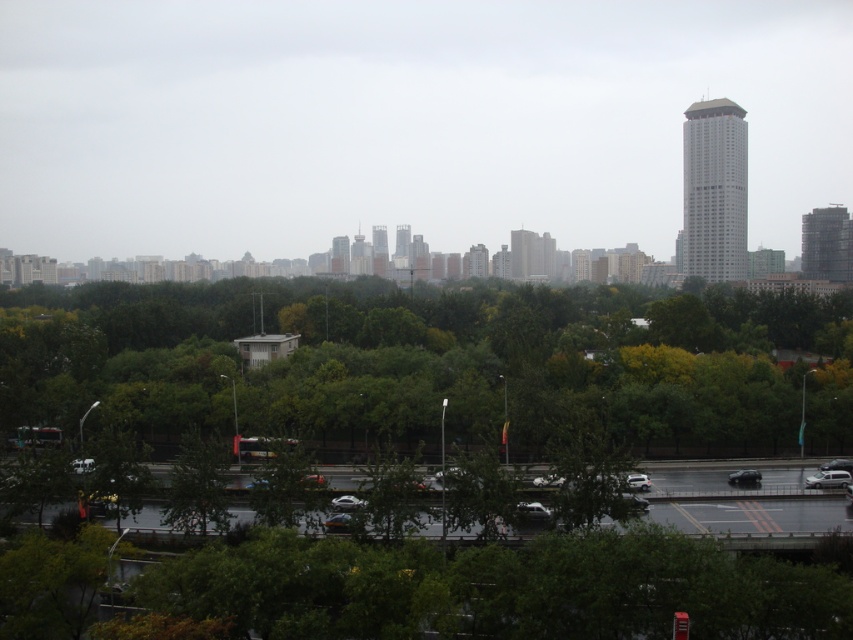
You are a city planner assessing the urban landscape. You need to determine if the transparent glass skyscraper at center will block sunlight from reaching the green leafy trees at center. Based on the scene description, what can you conclude?

The transparent glass skyscraper at center is taller than the green leafy trees at center, so it could potentially block sunlight from reaching them depending on the time of day and angle of the sun.

You are a city planner assessing the urban layout. Given the transparent glass skyscraper at center and the green leafy trees at center, which one occupies more horizontal space in the scene?

The transparent glass skyscraper at center has a larger width than the green leafy trees at center, so it occupies more horizontal space in the scene.

Looking at this image, you are a city planner reviewing this urban landscape. You need to determine if the transparent glass skyscraper at center can be seen from the green leafy trees at center. Based on their sizes, would the skyscraper block the view of the trees?

The transparent glass skyscraper at center is bigger than green leafy trees at center, so the skyscraper would block the view of the green leafy trees at center.